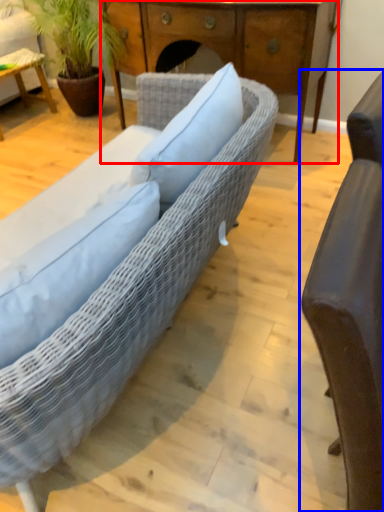
Question: Which object appears closest to the camera in this image, desk (highlighted by a red box) or chair (highlighted by a blue box)?

Choices:
 (A) desk
 (B) chair

Answer: (B)